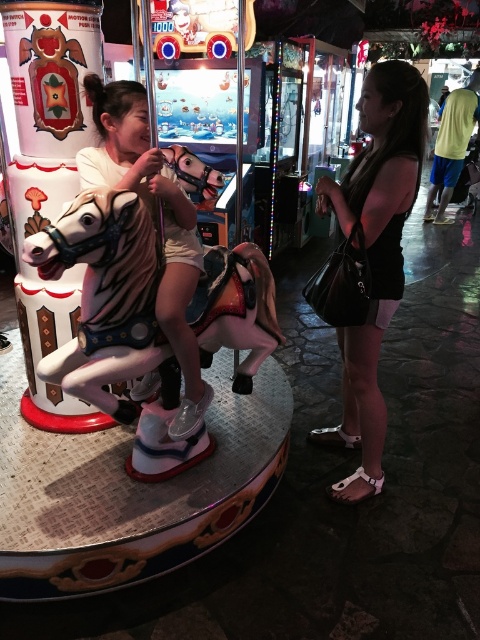
You are a photographer standing at the center of the carousel area. You have a camera in your hand and want to take a photo of the carousel horse with the girl riding it. There is a black leather handbag at center in your way. Can you move the handbag to get a clear shot? Explain your reasoning.

The black leather handbag at center and the camera are 1.97 meters apart. Since the handbag is only 2 meters away from the camera, you can easily move it out of the way to get a clear shot.

You are standing in the arcade and see two points marked in the scene. Which point is closer to you, point (204, 324) or point (170, 316)?

Point (170, 316) is closer to you because it is less further than point (204, 324).